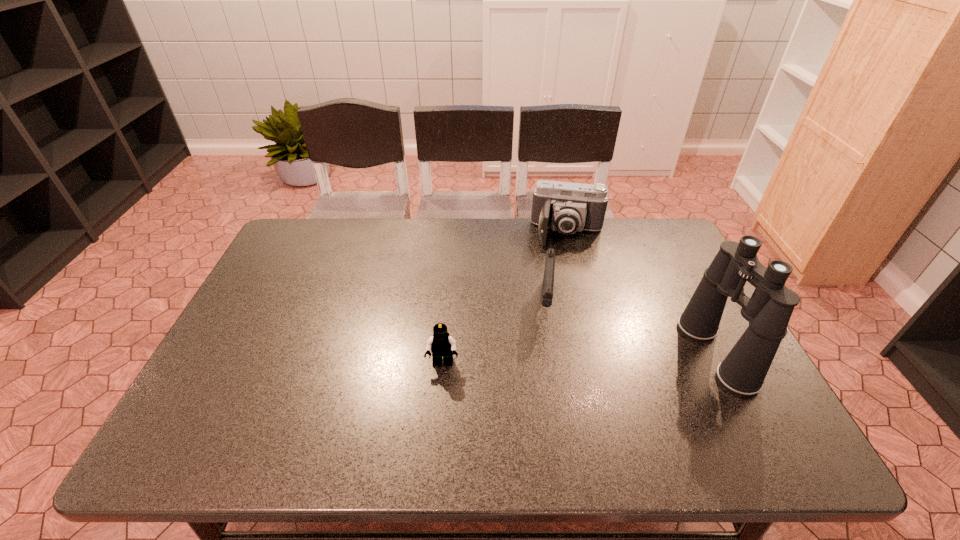
The height and width of the screenshot is (540, 960). Find the location of `free space located 0.250m at the front of the second tallest object with an open lens cover`. free space located 0.250m at the front of the second tallest object with an open lens cover is located at coordinates (561, 302).

Locate an element on the screen. This screenshot has width=960, height=540. free spot located at the barrel of the pistol is located at coordinates (545, 367).

Locate an element on the screen. free space located at the barrel of the pistol is located at coordinates (545, 374).

This screenshot has height=540, width=960. What are the coordinates of `free space located at the barrel of the pistol` in the screenshot? It's located at (546, 361).

You are a GUI agent. You are given a task and a screenshot of the screen. Output one action in this format:
    pyautogui.click(x=<x>, y=<y>)
    Task: Click on the object positioned at the far edge
    
    Given the screenshot: What is the action you would take?
    pyautogui.click(x=567, y=207)

You are a GUI agent. You are given a task and a screenshot of the screen. Output one action in this format:
    pyautogui.click(x=<x>, y=<y>)
    Task: Click on the object that is at the near edge
    
    Given the screenshot: What is the action you would take?
    tap(768, 311)

Locate an element on the screen. This screenshot has height=540, width=960. object present at the right edge is located at coordinates (768, 311).

The height and width of the screenshot is (540, 960). I want to click on object located at the near right corner, so click(x=768, y=311).

In the image, there is a desktop. Where is `vacant space at the far edge`? This screenshot has height=540, width=960. vacant space at the far edge is located at coordinates (376, 224).

At what (x,y) coordinates should I click in order to perform the action: click on vacant space at the near edge of the desktop. Please return your answer as a coordinate pair (x, y). The height and width of the screenshot is (540, 960). Looking at the image, I should click on (414, 398).